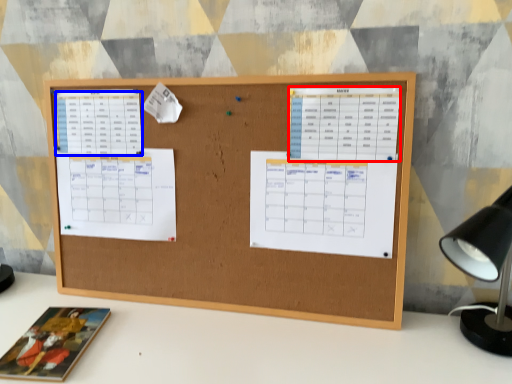
Question: Among these objects, which one is farthest to the camera, list (highlighted by a red box) or list (highlighted by a blue box)?

Choices:
 (A) list
 (B) list

Answer: (B)